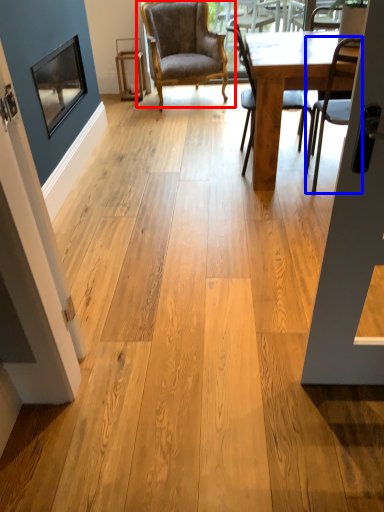
Question: Among these objects, which one is nearest to the camera, chair (highlighted by a red box) or chair (highlighted by a blue box)?

Choices:
 (A) chair
 (B) chair

Answer: (B)